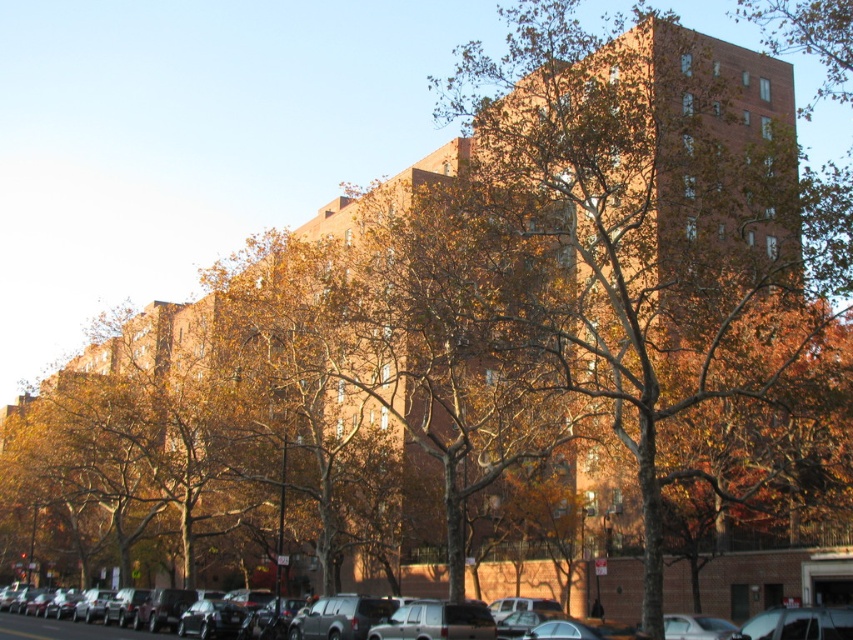
You are a pedestrian standing on the sidewalk in front of the multi story brick building. You see the brown textured tree at center and the matte black suv at center. Which object is closer to you?

The brown textured tree at center is closer to you because it is positioned further to the viewer than the matte black suv at center.

Looking at this image, you are a delivery driver who needs to park your matte black suv at center in a spot that allows you to see the brown textured tree at center clearly. Based on their sizes, which object should you position closer to ensure visibility?

The brown textured tree at center is larger than the matte black suv at center, so positioning the matte black suv at center closer to the tree will allow you to see the tree clearly while avoiding obstruction by the larger tree.

Consider the image. You are a delivery person needing to park your vehicle. You see the brown textured tree at center and the matte black suv at center. Which one is taller and should you avoid hitting while backing up?

The brown textured tree at center is taller than the matte black suv at center, so you should avoid hitting the brown textured tree at center while backing up to prevent damage.